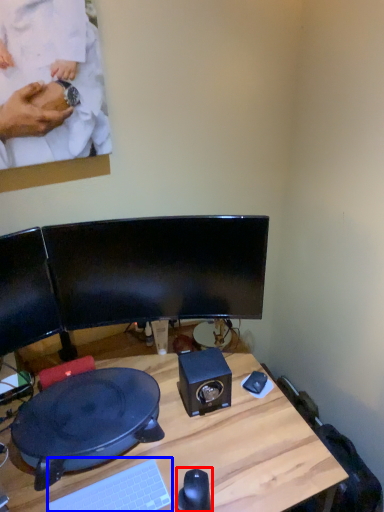
Question: Which of the following is the closest to the observer, mouse (highlighted by a red box) or computer keyboard (highlighted by a blue box)?

Choices:
 (A) mouse
 (B) computer keyboard

Answer: (B)